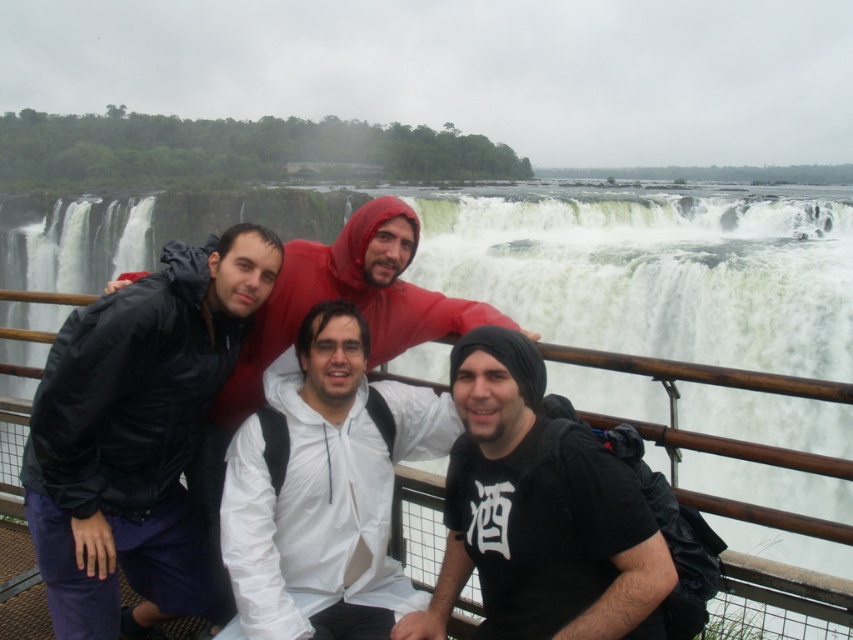
Question: Which point is closer to the camera?

Choices:
 (A) black matte t-shirt at center
 (B) white matte jacket at center
 (C) matte black jacket at left

Answer: (A)

Question: Which object is farther from the camera taking this photo?

Choices:
 (A) matte black jacket at left
 (B) white matte jacket at center

Answer: (A)

Question: Is matte black jacket at left smaller than white matte jacket at center?

Choices:
 (A) no
 (B) yes

Answer: (A)

Question: Does matte black jacket at left have a larger size compared to black matte t-shirt at center?

Choices:
 (A) yes
 (B) no

Answer: (A)

Question: Is black matte t-shirt at center to the right of white matte jacket at center from the viewer's perspective?

Choices:
 (A) no
 (B) yes

Answer: (B)

Question: Which of the following is the farthest from the observer?

Choices:
 (A) (224, 536)
 (B) (521, 515)
 (C) (141, 604)

Answer: (C)